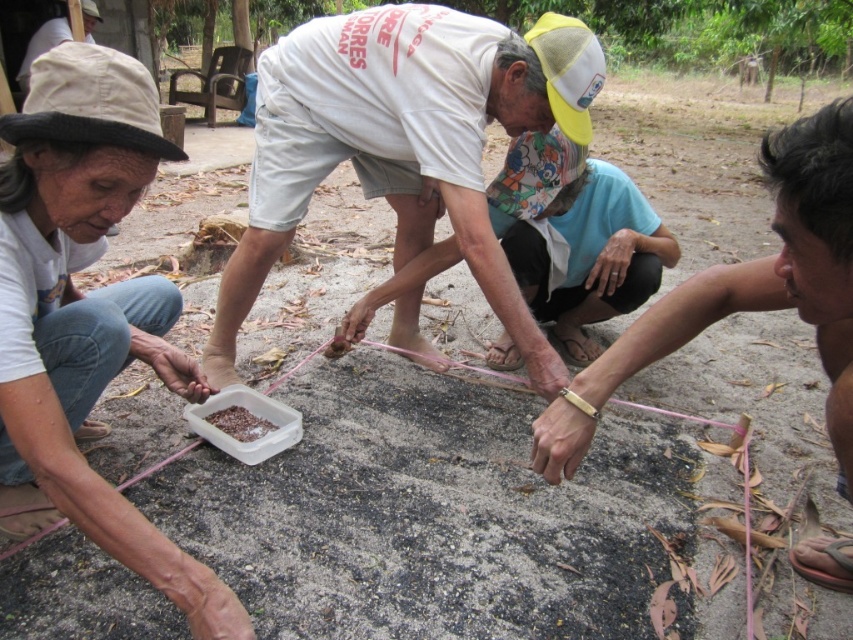
Question: Is gray concrete rock at lower left to the left of brown matte food at center from the viewer's perspective?

Choices:
 (A) no
 (B) yes

Answer: (A)

Question: Among these points, which one is nearest to the camera?

Choices:
 (A) (531, 608)
 (B) (506, 132)
 (C) (791, 164)

Answer: (C)

Question: Can you confirm if gray concrete rock at lower left is wider than white cotton shirt at center?

Choices:
 (A) yes
 (B) no

Answer: (A)

Question: Which of the following is the farthest from the observer?

Choices:
 (A) brown leather sandal at lower right
 (B) brown matte food at center

Answer: (B)

Question: From the image, what is the correct spatial relationship of gray concrete rock at lower left in relation to white cotton shirt at lower left?

Choices:
 (A) below
 (B) above

Answer: (A)

Question: Considering the real-world distances, which object is closest to the matte white cap at upper left?

Choices:
 (A) brown leather sandal at lower right
 (B) brown matte food at center
 (C) white cotton shirt at center

Answer: (C)